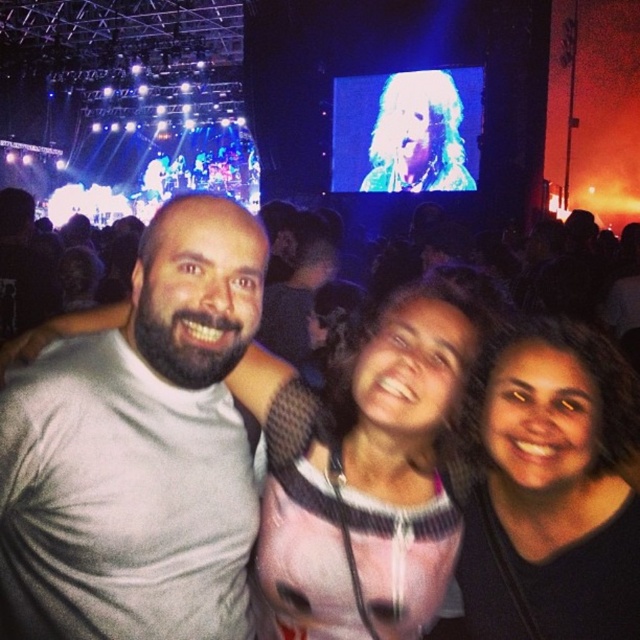
Between pink mesh top at center and dark hair at center, which one has less height?

dark hair at center is shorter.

Does pink mesh top at center have a greater height compared to dark hair at center?

Yes.

Locate an element on the screen. This screenshot has width=640, height=640. pink mesh top at center is located at coordinates click(369, 468).

In the scene shown: Which is more to the left, gray matte t-shirt at left or dark hair at center?

Positioned to the left is gray matte t-shirt at left.

Who is more forward, [48,536] or [548,477]?

Positioned in front is point [48,536].

This screenshot has height=640, width=640. I want to click on gray matte t-shirt at left, so click(138, 451).

Who is positioned more to the right, gray matte t-shirt at left or pink mesh top at center?

pink mesh top at center is more to the right.

Is point (4, 596) in front of point (372, 406)?

Yes, point (4, 596) is closer to viewer.

I want to click on gray matte t-shirt at left, so click(138, 451).